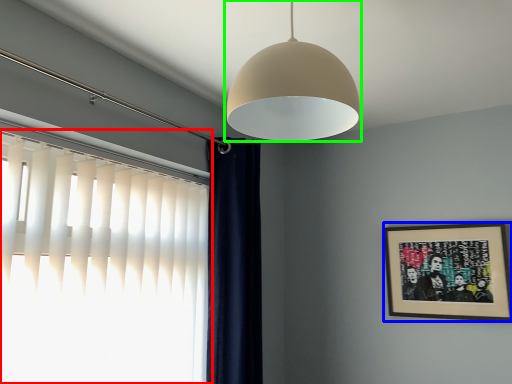
Question: Which is farther away from window (highlighted by a red box)? picture frame (highlighted by a blue box) or lamp (highlighted by a green box)?

Choices:
 (A) picture frame
 (B) lamp

Answer: (A)